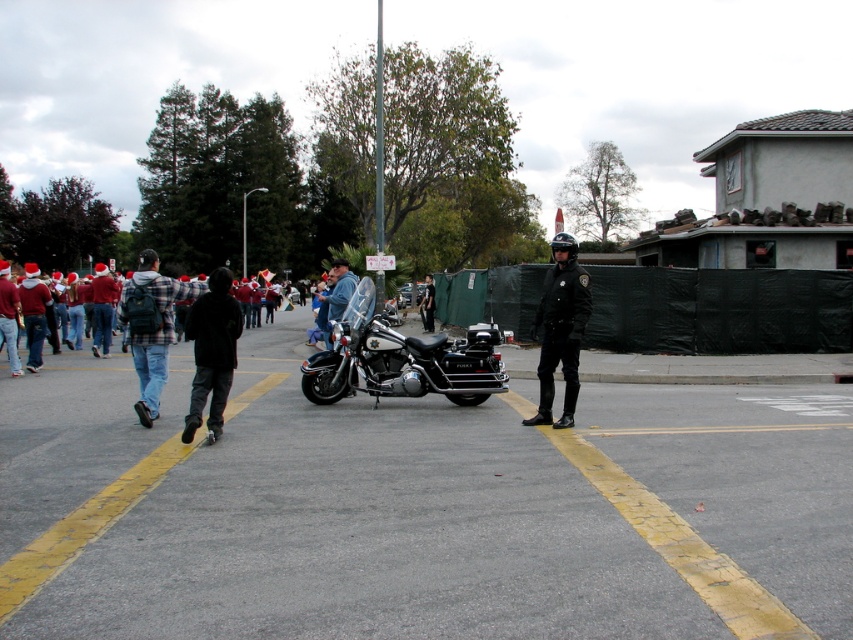
Is point (206, 612) positioned after point (331, 301)?

No, it is not.

Between smooth asphalt parking lot at center and denim jacket at center, which one is positioned higher?

denim jacket at center is above.

Who is more distant from viewer, (408, 604) or (323, 336)?

The point (323, 336) is more distant.

You are a GUI agent. You are given a task and a screenshot of the screen. Output one action in this format:
    pyautogui.click(x=<x>, y=<y>)
    Task: Click on the smooth asphalt parking lot at center
    
    Given the screenshot: What is the action you would take?
    pyautogui.click(x=408, y=508)

Does point (814, 392) come in front of point (561, 419)?

No, (814, 392) is further to viewer.

Where is `smooth asphalt parking lot at center`? Image resolution: width=853 pixels, height=640 pixels. smooth asphalt parking lot at center is located at coordinates (408, 508).

In order to click on smooth asphalt parking lot at center in this screenshot , I will do `click(408, 508)`.

You are a GUI agent. You are given a task and a screenshot of the screen. Output one action in this format:
    pyautogui.click(x=<x>, y=<y>)
    Task: Click on the smooth asphalt parking lot at center
    
    Given the screenshot: What is the action you would take?
    pyautogui.click(x=408, y=508)

Is black uniformed officer at center bigger than denim jacket at center?

Indeed, black uniformed officer at center has a larger size compared to denim jacket at center.

Who is positioned more to the left, black uniformed officer at center or denim jacket at center?

denim jacket at center is more to the left.

Is point (561, 364) positioned in front of point (349, 289)?

Yes, it is in front of point (349, 289).

Identify the location of black uniformed officer at center. (560, 330).